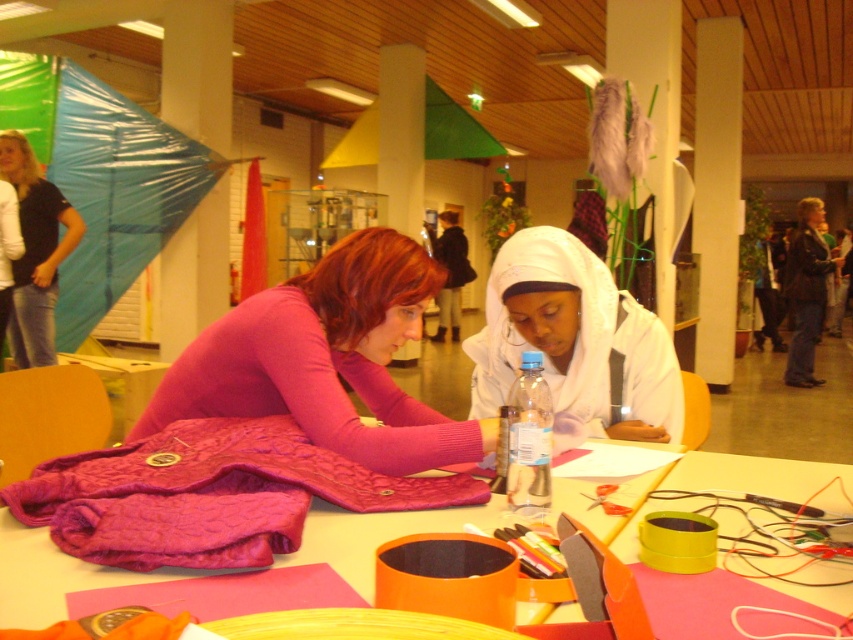
The width and height of the screenshot is (853, 640). What do you see at coordinates (210, 493) in the screenshot?
I see `quilted pink fabric at center` at bounding box center [210, 493].

Does point (432, 493) come closer to viewer compared to point (611, 353)?

Yes, point (432, 493) is in front of point (611, 353).

In order to click on quilted pink fabric at center in this screenshot , I will do `click(210, 493)`.

Does matte pink sweater at center appear on the right side of white matte hijab at center?

No, matte pink sweater at center is not to the right of white matte hijab at center.

Is matte pink sweater at center behind white matte hijab at center?

No, matte pink sweater at center is in front of white matte hijab at center.

The height and width of the screenshot is (640, 853). What are the coordinates of `matte pink sweater at center` in the screenshot? It's located at (326, 358).

Where is `matte pink sweater at center`? The image size is (853, 640). matte pink sweater at center is located at coordinates [x=326, y=358].

Who is taller, quilted pink fabric at center or quilted fabric jacket at center?

quilted pink fabric at center

Between quilted pink fabric at center and quilted fabric jacket at center, which one appears on the right side from the viewer's perspective?

quilted fabric jacket at center is more to the right.

What are the coordinates of `quilted pink fabric at center` in the screenshot? It's located at (210, 493).

In order to click on quilted pink fabric at center in this screenshot , I will do `click(210, 493)`.